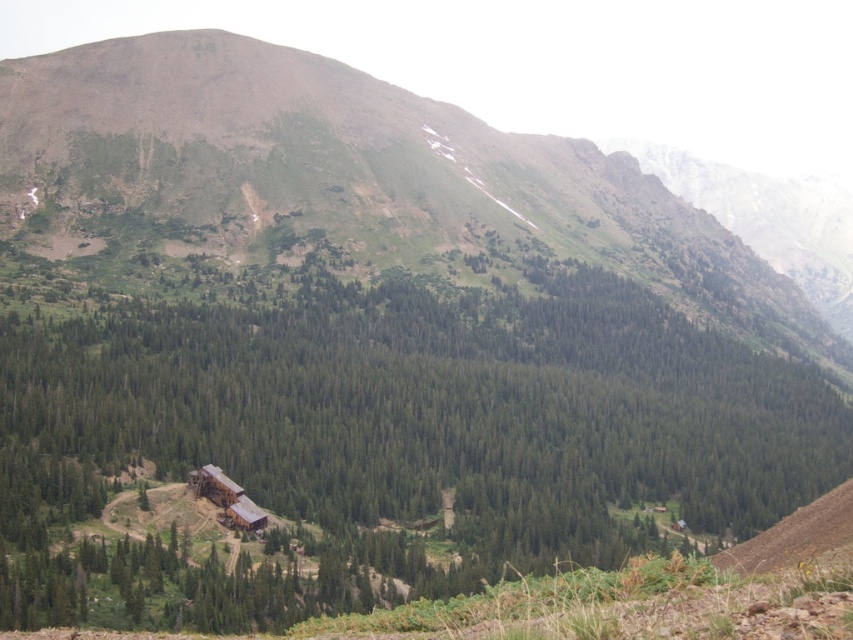
You are planning to hike from the green wood cabin at center to the green grassy mountain at upper center. Which object will you see first as you start your hike?

You will see the green wood cabin at center first because it is closer to the viewer than the green grassy mountain at upper center, so it would appear in front as you begin your hike.

You are standing at the point labeled point (x=709, y=458) in the mountain landscape image. You want to walk to the point labeled point (x=321, y=118). Which direction should you move to get closer to your destination?

Since point (x=709, y=458) is closer to the viewer than point (x=321, y=118), you should move away from the foreground towards the background to reach your destination.